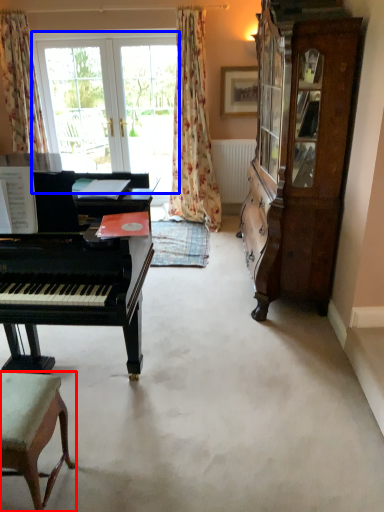
Question: Among these objects, which one is farthest to the camera, chair (highlighted by a red box) or bay window (highlighted by a blue box)?

Choices:
 (A) chair
 (B) bay window

Answer: (B)